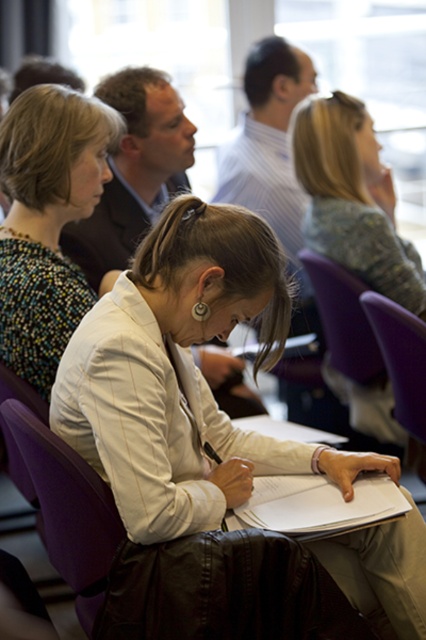
Between multicolored beaded necklace at upper left and purple plastic chair at lower center, which one is positioned lower?

purple plastic chair at lower center is below.

What do you see at coordinates (46, 221) in the screenshot? This screenshot has height=640, width=426. I see `multicolored beaded necklace at upper left` at bounding box center [46, 221].

Where is `multicolored beaded necklace at upper left`? multicolored beaded necklace at upper left is located at coordinates (46, 221).

Does purple plastic chair at center appear on the right side of purple plastic chair at lower center?

No, purple plastic chair at center is not to the right of purple plastic chair at lower center.

Is point (347, 365) more distant than point (408, 419)?

Yes, it is.

Find the location of a particular element. purple plastic chair at center is located at coordinates (342, 317).

Can you confirm if white paper clipboard at center is wider than purple plastic chair at lower center?

Correct, the width of white paper clipboard at center exceeds that of purple plastic chair at lower center.

Does white paper clipboard at center have a larger size compared to purple plastic chair at lower center?

No, white paper clipboard at center is not bigger than purple plastic chair at lower center.

Identify the location of white paper clipboard at center. The height and width of the screenshot is (640, 426). (317, 506).